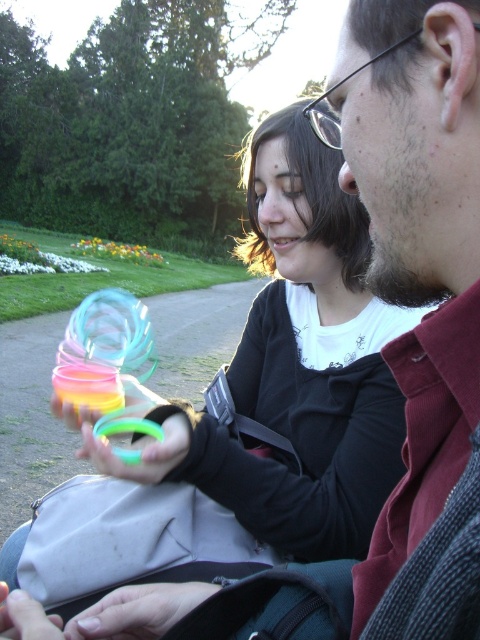
Can you confirm if dark red shirt at right is smaller than matte black hand at lower left?

Actually, dark red shirt at right might be larger than matte black hand at lower left.

Between dark red shirt at right and matte black hand at lower left, which one is positioned higher?

Positioned higher is dark red shirt at right.

Measure the distance between point [363,168] and camera.

They are 23.48 inches apart.

Locate an element on the screen. The height and width of the screenshot is (640, 480). dark red shirt at right is located at coordinates (x=417, y=241).

Does point (364, 600) lie behind point (115, 625)?

No, (364, 600) is in front of (115, 625).

This screenshot has height=640, width=480. I want to click on dark red shirt at right, so click(x=417, y=241).

Who is more distant from viewer, [97,451] or [10,632]?

The point [97,451] is behind.

Which is in front, point (172, 424) or point (7, 589)?

Positioned in front is point (7, 589).

Is point (151, 442) more distant than point (27, 625)?

Yes.

Identify the location of neon rubber bracelet at center. The width and height of the screenshot is (480, 640). (141, 451).